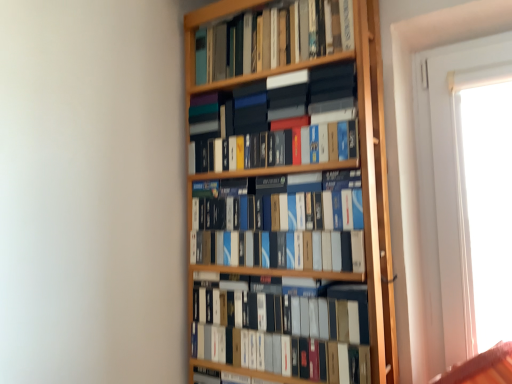
Question: Which direction should I rotate to look at blue matte book at center, which is the 3th book in top-to-bottom order, — up or down?

Choices:
 (A) up
 (B) down

Answer: (B)

Question: Is matte black box at center, the 4th book positioned from the top, further to camera compared to blue matte book at center, the second book from the bottom?

Choices:
 (A) no
 (B) yes

Answer: (A)

Question: Can you confirm if matte black box at center, the 4th book positioned from the top, is taller than blue matte book at center, the second book from the bottom?

Choices:
 (A) yes
 (B) no

Answer: (A)

Question: Is matte black box at center, positioned as the first book in bottom-to-top order, oriented away from blue matte book at center, the second book from the bottom?

Choices:
 (A) yes
 (B) no

Answer: (B)

Question: From a real-world perspective, does matte black box at center, the 4th book positioned from the top, stand above blue matte book at center, the second book from the bottom?

Choices:
 (A) no
 (B) yes

Answer: (A)

Question: Is matte black box at center, positioned as the first book in bottom-to-top order, outside blue matte book at center, which is the 3th book in top-to-bottom order?

Choices:
 (A) no
 (B) yes

Answer: (B)

Question: Considering the relative sizes of matte black box at center, the 4th book positioned from the top, and blue matte book at center, the second book from the bottom, in the image provided, is matte black box at center, the 4th book positioned from the top, shorter than blue matte book at center, the second book from the bottom,?

Choices:
 (A) no
 (B) yes

Answer: (A)

Question: Is matte black box at center, positioned as the first book in bottom-to-top order, looking in the opposite direction of matte black books at center, the third book positioned from the bottom?

Choices:
 (A) no
 (B) yes

Answer: (A)

Question: Is matte black box at center, the 4th book positioned from the top, at the left side of matte black books at center, the 2th book when ordered from top to bottom?

Choices:
 (A) yes
 (B) no

Answer: (B)

Question: Would you say matte black books at center, the 2th book when ordered from top to bottom, is part of matte black box at center, positioned as the first book in bottom-to-top order,'s contents?

Choices:
 (A) yes
 (B) no

Answer: (B)

Question: Is matte black box at center, the 4th book positioned from the top, not near matte black books at center, the 2th book when ordered from top to bottom?

Choices:
 (A) yes
 (B) no

Answer: (B)

Question: Are matte black box at center, positioned as the first book in bottom-to-top order, and matte black books at center, the third book positioned from the bottom, making contact?

Choices:
 (A) yes
 (B) no

Answer: (B)

Question: From a real-world perspective, is matte black box at center, positioned as the first book in bottom-to-top order, located higher than matte black books at center, the third book positioned from the bottom?

Choices:
 (A) no
 (B) yes

Answer: (A)

Question: Is hardcover books at upper center, which is the 1th book in top-to-bottom order, in contact with matte black books at center, the third book positioned from the bottom?

Choices:
 (A) no
 (B) yes

Answer: (A)